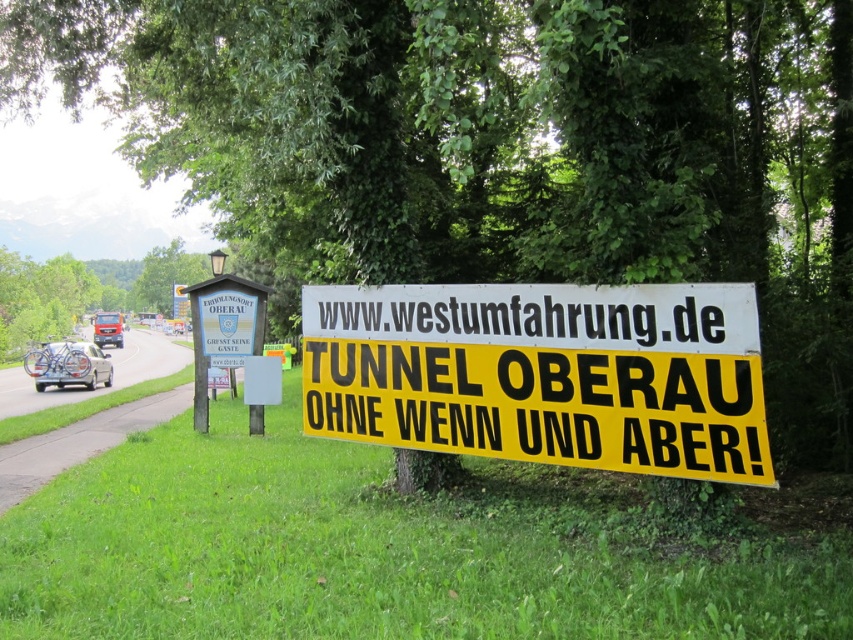
Does yellow paper sign at center have a greater width compared to metallic silver van at left?

No, yellow paper sign at center is not wider than metallic silver van at left.

Which is behind, point (469, 372) or point (96, 330)?

The point (96, 330) is more distant.

This screenshot has height=640, width=853. I want to click on yellow paper sign at center, so click(x=544, y=372).

Which is more to the right, yellow paper sign at center or white matte car at left?

Positioned to the right is yellow paper sign at center.

Can you confirm if yellow paper sign at center is smaller than white matte car at left?

Correct, yellow paper sign at center occupies less space than white matte car at left.

Is point (538, 308) positioned before point (97, 352)?

Yes, point (538, 308) is in front of point (97, 352).

Find the location of `yellow paper sign at center`. yellow paper sign at center is located at coordinates (544, 372).

Which of these two, wooden signboard at left or metallic silver van at left, stands taller?

Standing taller between the two is metallic silver van at left.

Is wooden signboard at left to the right of metallic silver van at left from the viewer's perspective?

Indeed, wooden signboard at left is positioned on the right side of metallic silver van at left.

Is point (206, 285) farther from camera compared to point (119, 337)?

No, (206, 285) is closer to viewer.

Identify the location of wooden signboard at left. (222, 326).